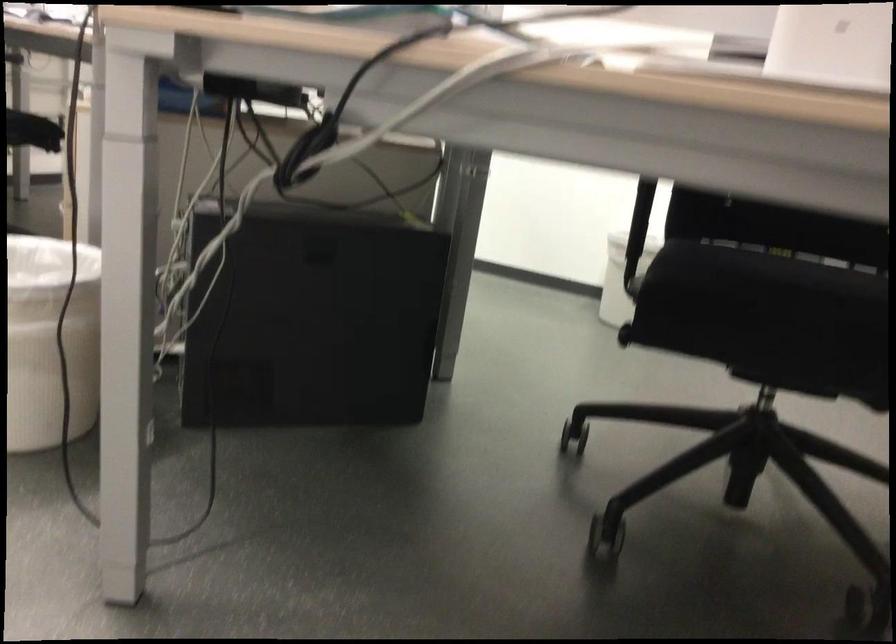
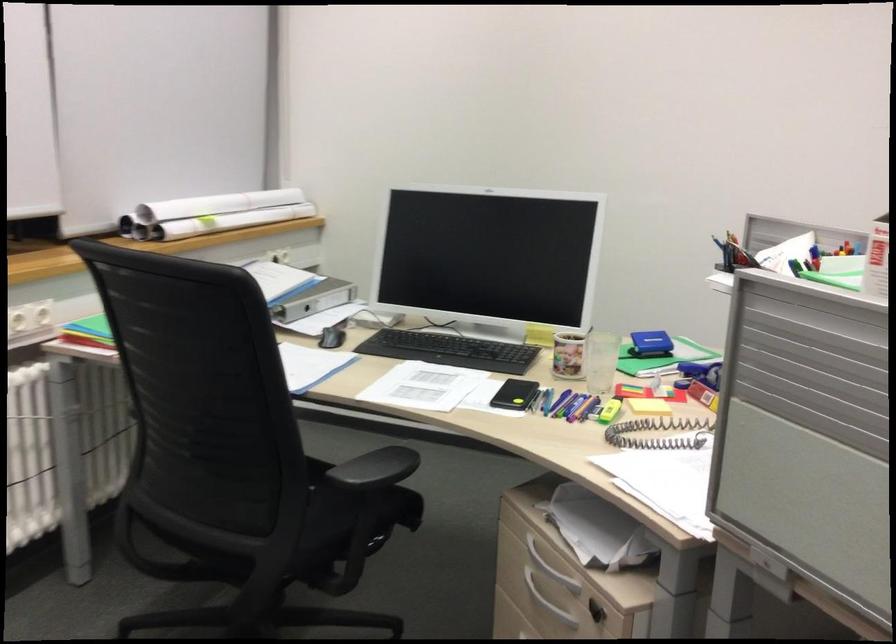
Which direction would the cameraman need to move to produce the second image?

The movement direction of the cameraman is left, forward.